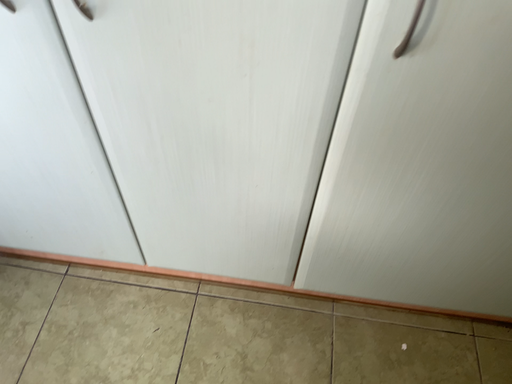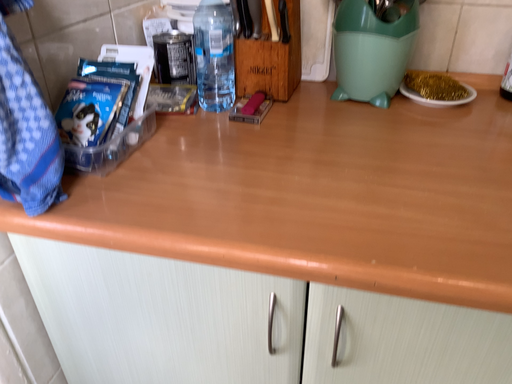
Question: Which way did the camera rotate in the video?

Choices:
 (A) rotated downward
 (B) rotated upward

Answer: (B)